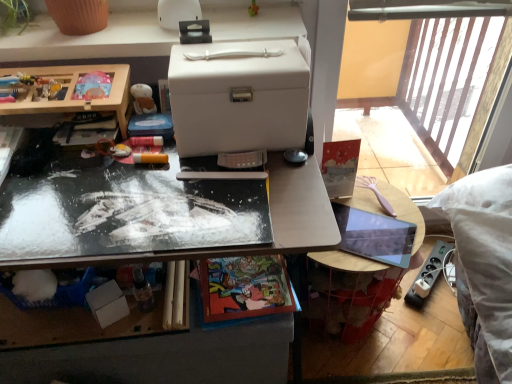
Locate an element on the screen. empty space that is ontop of white plastic storage box at upper center, the first desk viewed from the top (from a real-world perspective) is located at coordinates (122, 26).